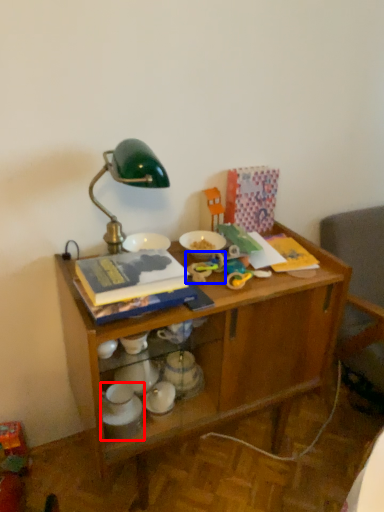
Question: Which of the following is the farthest to the observer, tableware (highlighted by a red box) or toy (highlighted by a blue box)?

Choices:
 (A) tableware
 (B) toy

Answer: (B)